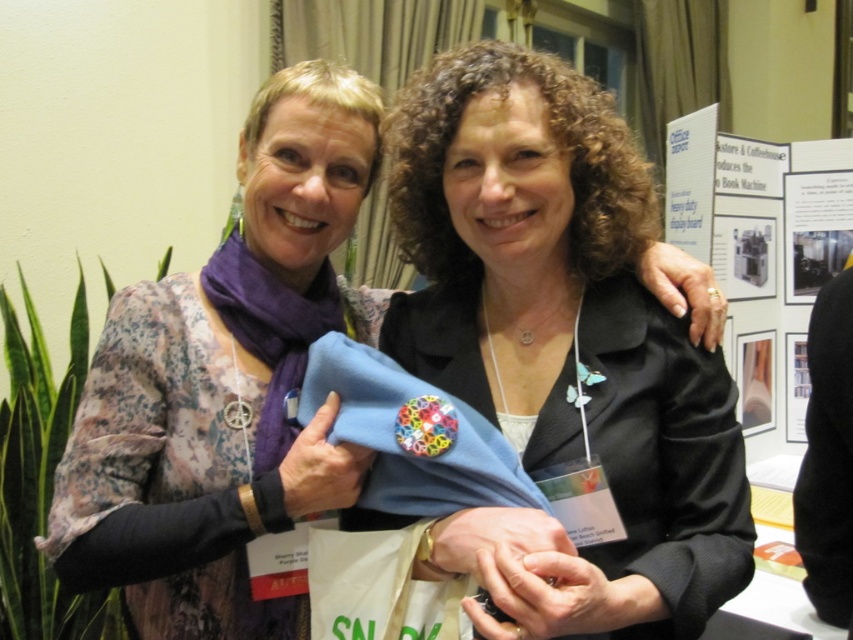
You are a photographer trying to focus on the black matte blazer at center and the blue fabric at center in the image. Which object should you adjust your camera focus on first to ensure both are in focus?

The black matte blazer at center is closer to the viewer than the blue fabric at center, so you should focus on the black matte blazer at center first. This will ensure the blue fabric at center is also in focus as it is further away.

You are trying to determine if the black matte blazer at center can completely cover the blue fabric at center when placed over it. Based on their sizes, what do you think?

The black matte blazer at center might be wider than blue fabric at center, so it could potentially cover it depending on the exact dimensions.

You are a photographer trying to focus on two points in the image. The first point is at coordinate point [619,296] and the second is at point [206,323]. Which point should you focus on first if you want to start with the one closer to you?

Point [619,296] is closer to the viewer than point [206,323], so you should focus on point [619,296] first.